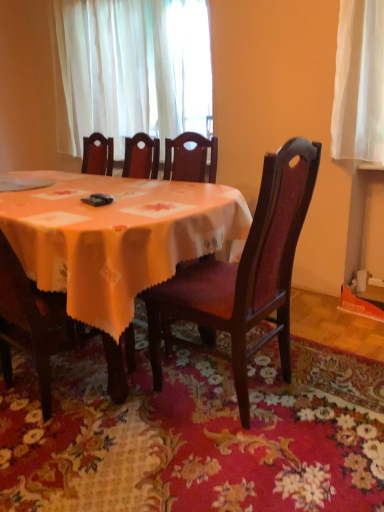
Locate an element on the screen. free space in front of wooden chair at center, the first chair when ordered from left to right is located at coordinates (74, 460).